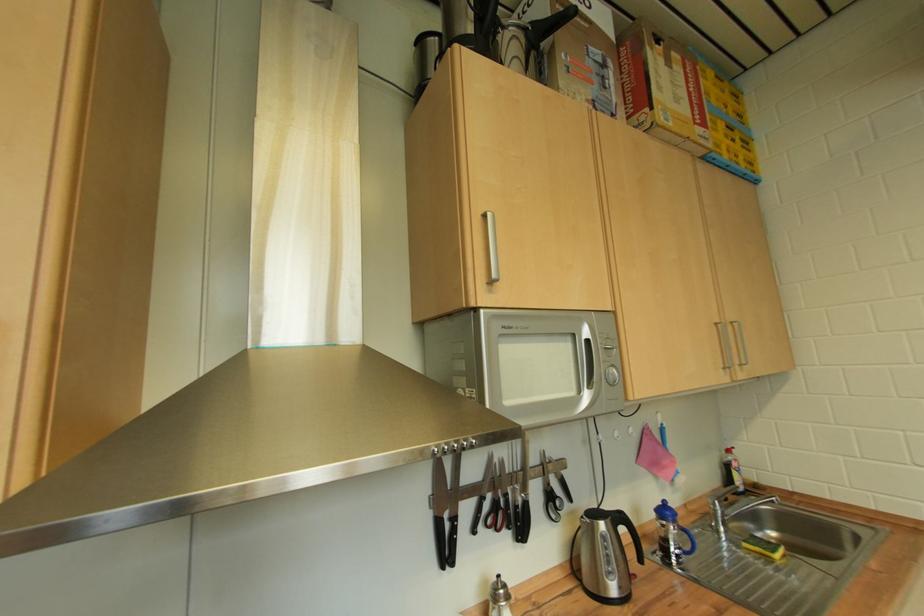
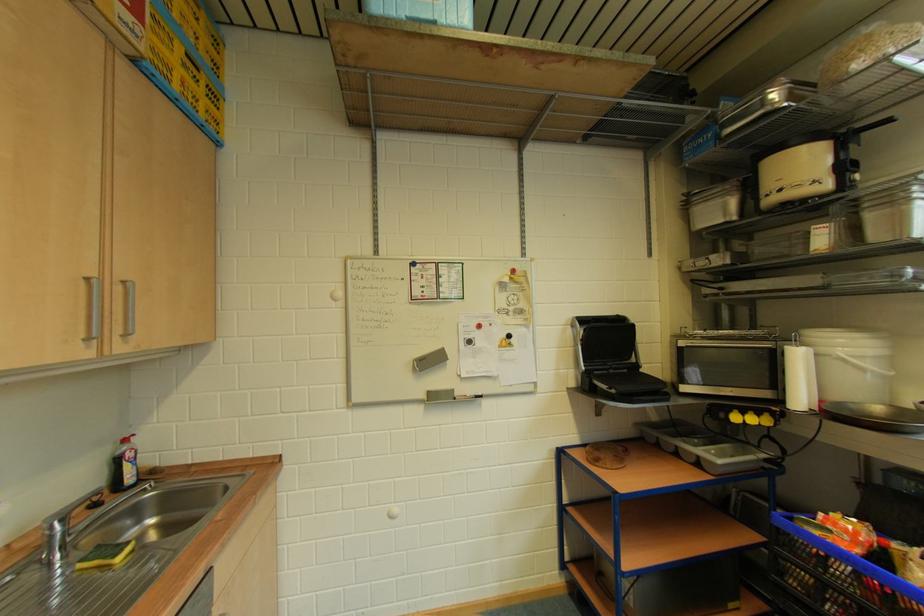
Where in the second image is the point corresponding to [781,554] from the first image?

(124, 559)